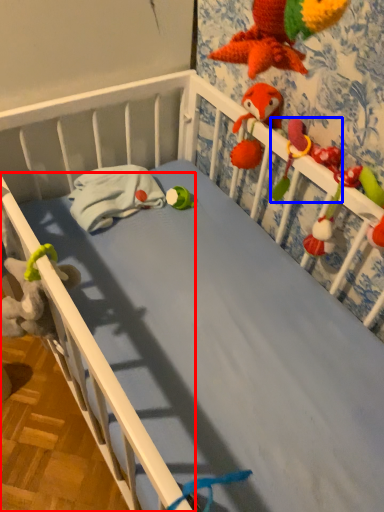
Question: Which point is further to the camera, rail (highlighted by a red box) or parrot (highlighted by a blue box)?

Choices:
 (A) rail
 (B) parrot

Answer: (A)